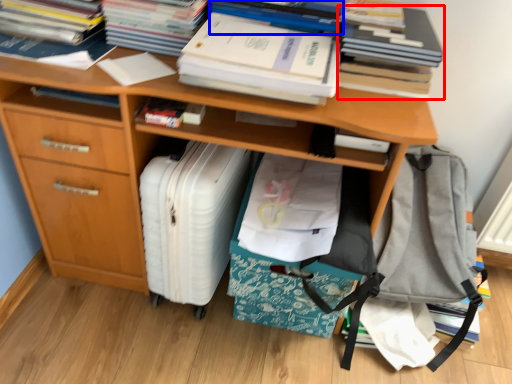
Question: Which object appears farthest to the camera in this image, book (highlighted by a red box) or book (highlighted by a blue box)?

Choices:
 (A) book
 (B) book

Answer: (B)